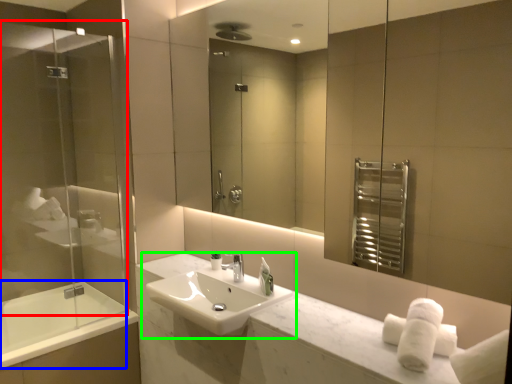
Question: Considering the real-world distances, which object is closest to screen door (highlighted by a red box)? bath (highlighted by a blue box) or sink (highlighted by a green box).

Choices:
 (A) bath
 (B) sink

Answer: (A)